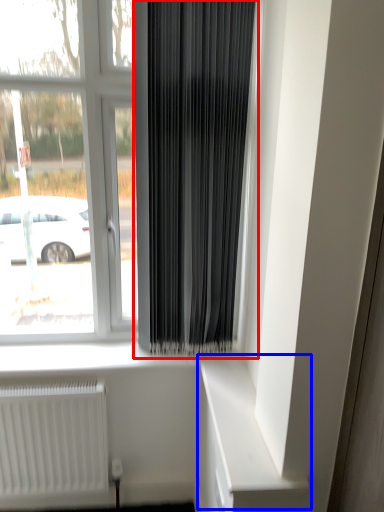
Question: Which object is closer to the camera taking this photo, curtain (highlighted by a red box) or shelf (highlighted by a blue box)?

Choices:
 (A) curtain
 (B) shelf

Answer: (B)